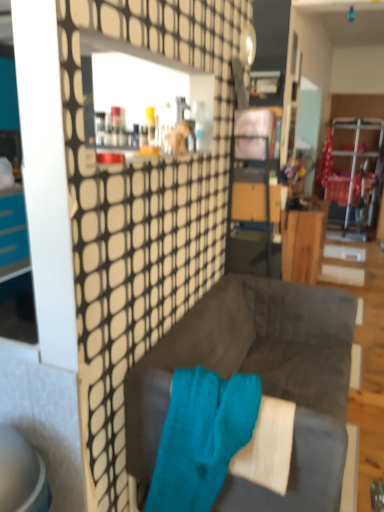
Question: From the image's perspective, is wooden desk at center over teal soft towel at center?

Choices:
 (A) no
 (B) yes

Answer: (B)

Question: Is wooden desk at center closer to the viewer compared to teal soft towel at center?

Choices:
 (A) yes
 (B) no

Answer: (B)

Question: Can you confirm if wooden desk at center is shorter than teal soft towel at center?

Choices:
 (A) no
 (B) yes

Answer: (A)

Question: Is wooden desk at center facing towards teal soft towel at center?

Choices:
 (A) yes
 (B) no

Answer: (B)

Question: Does wooden desk at center have a greater width compared to teal soft towel at center?

Choices:
 (A) yes
 (B) no

Answer: (A)

Question: From a real-world perspective, is wooden desk at center physically located above or below teal soft towel at center?

Choices:
 (A) below
 (B) above

Answer: (A)

Question: Based on their positions, is wooden desk at center located to the left or right of teal soft towel at center?

Choices:
 (A) left
 (B) right

Answer: (B)

Question: From the image's perspective, is wooden desk at center above or below teal soft towel at center?

Choices:
 (A) above
 (B) below

Answer: (A)

Question: Which is correct: wooden desk at center is inside teal soft towel at center, or outside of it?

Choices:
 (A) inside
 (B) outside

Answer: (B)

Question: Is wooden desk at center wider or thinner than velvet dark gray couch at center?

Choices:
 (A) thin
 (B) wide

Answer: (A)

Question: Considering their positions, is wooden desk at center located in front of or behind velvet dark gray couch at center?

Choices:
 (A) behind
 (B) front

Answer: (A)

Question: Is wooden desk at center situated inside velvet dark gray couch at center or outside?

Choices:
 (A) inside
 (B) outside

Answer: (B)

Question: From the image's perspective, is wooden desk at center above or below velvet dark gray couch at center?

Choices:
 (A) above
 (B) below

Answer: (A)

Question: From the image's perspective, is velvet dark gray couch at center above or below wooden desk at center?

Choices:
 (A) below
 (B) above

Answer: (A)

Question: Based on their positions, is velvet dark gray couch at center located to the left or right of wooden desk at center?

Choices:
 (A) left
 (B) right

Answer: (A)